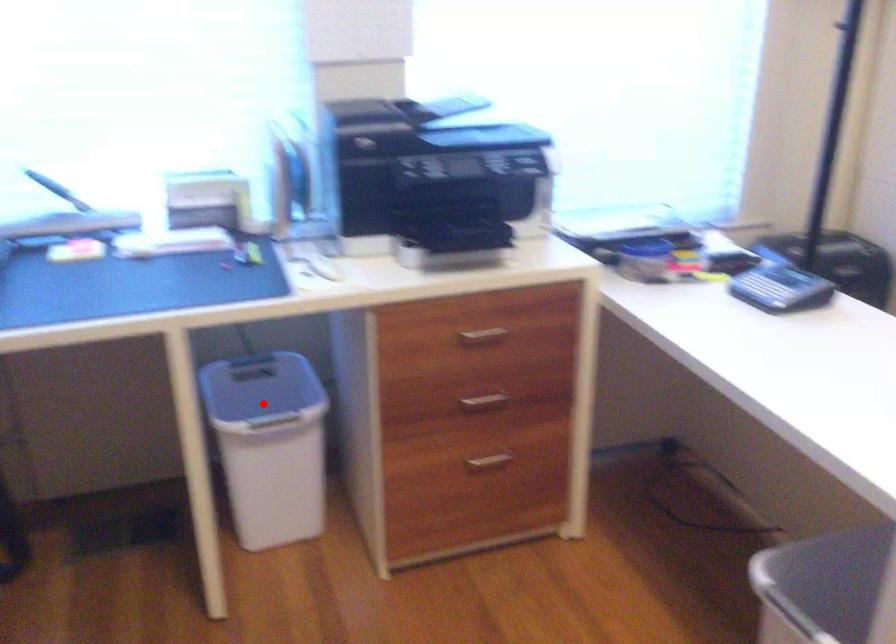
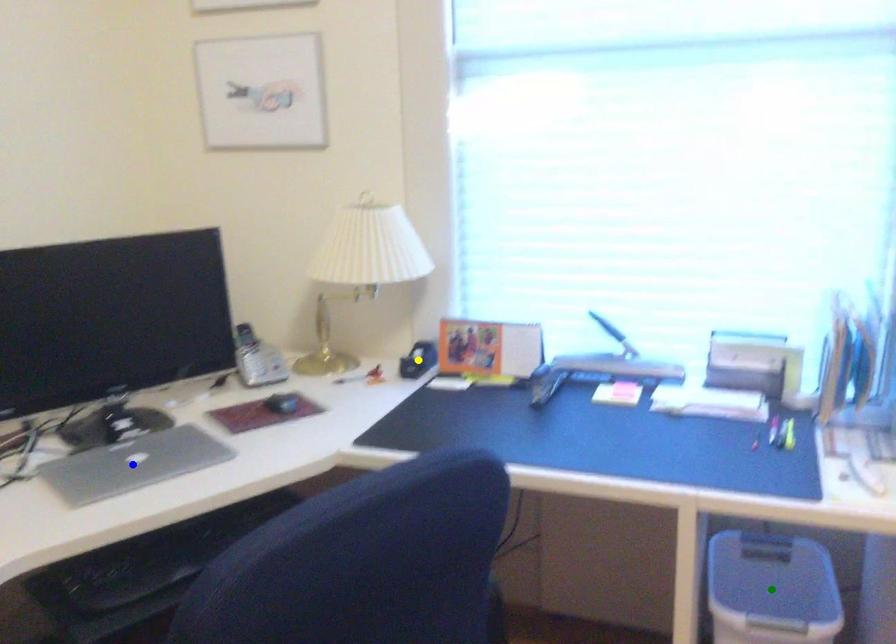
Question: I am providing you with two images of the same scene from different viewpoints. A red point is marked on the first image. You are given multiple points on the second image. Which mark in image 2 goes with the point in image 1?

Choices:
 (A) yellow point
 (B) blue point
 (C) green point

Answer: (C)